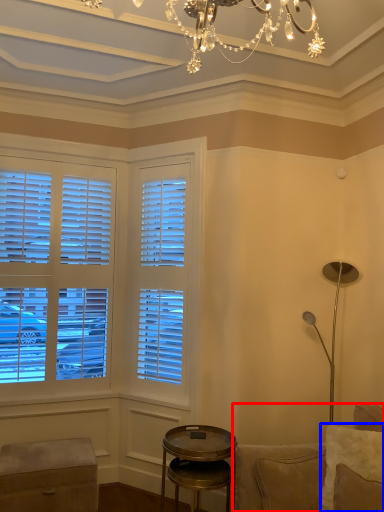
Question: Which point is further to the camera, studio couch (highlighted by a red box) or pillow (highlighted by a blue box)?

Choices:
 (A) studio couch
 (B) pillow

Answer: (B)